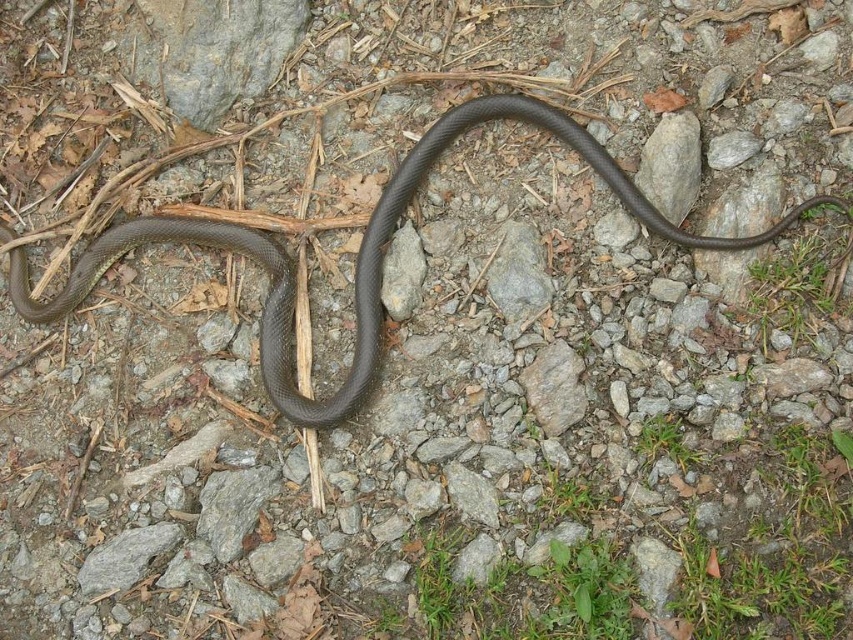
Does shiny black snake at center appear on the left side of gray rough rock at center?

Correct, you'll find shiny black snake at center to the left of gray rough rock at center.

Can you confirm if shiny black snake at center is positioned above gray rough rock at center?

Yes.

What do you see at coordinates (358, 253) in the screenshot? The height and width of the screenshot is (640, 853). I see `shiny black snake at center` at bounding box center [358, 253].

This screenshot has width=853, height=640. Find the location of `shiny black snake at center`. shiny black snake at center is located at coordinates (358, 253).